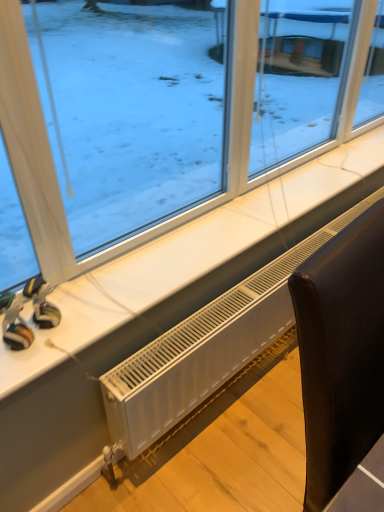
Locate an element on the screen. free space to the back side of matte plastic toy at lower left, acting as the 1th toy starting from the right is located at coordinates (81, 289).